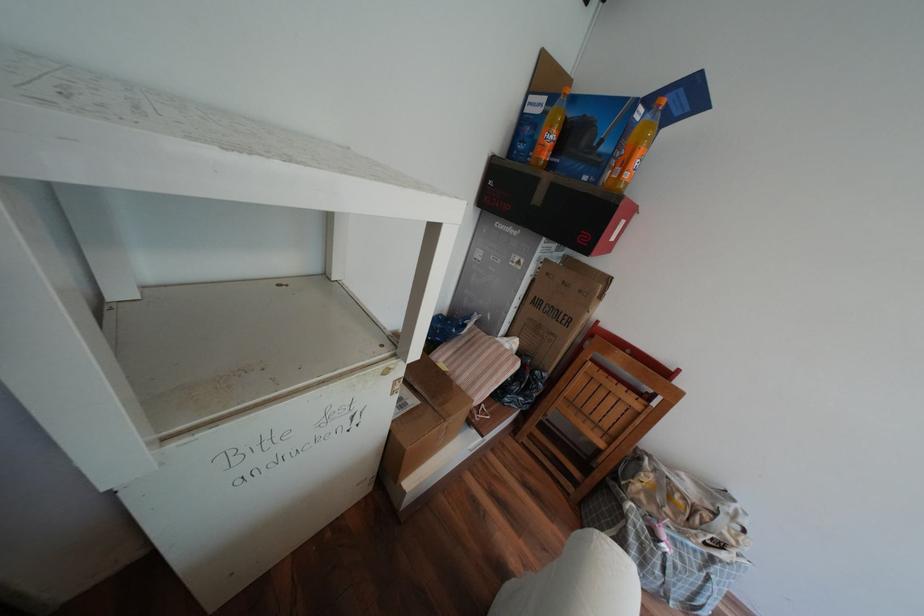
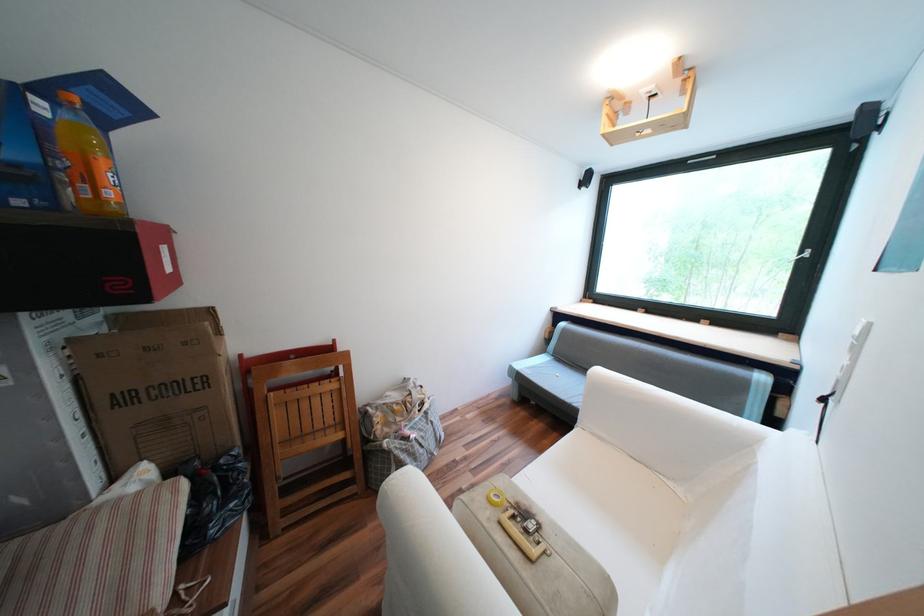
The point at (637, 176) is marked in the first image. Where is the corresponding point in the second image?

(118, 193)